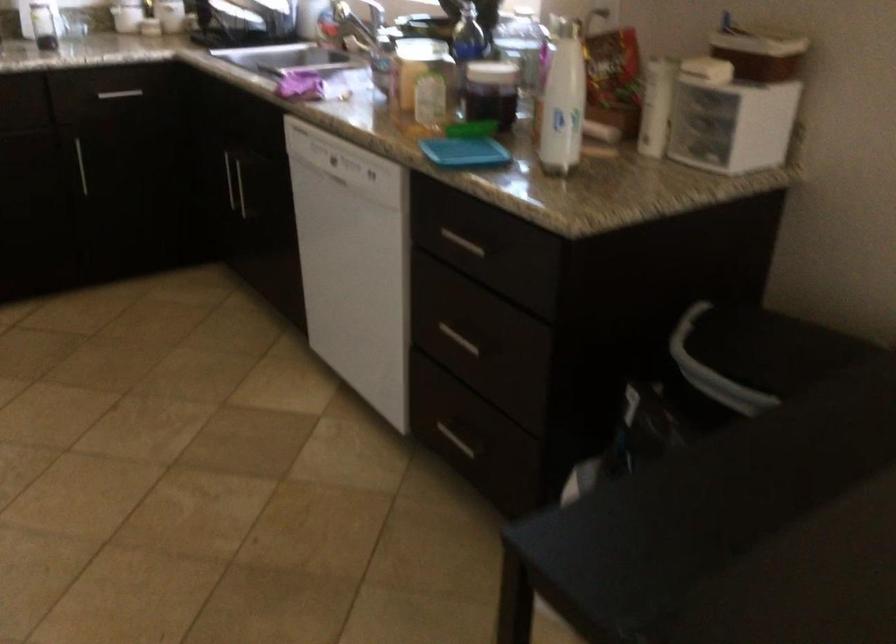
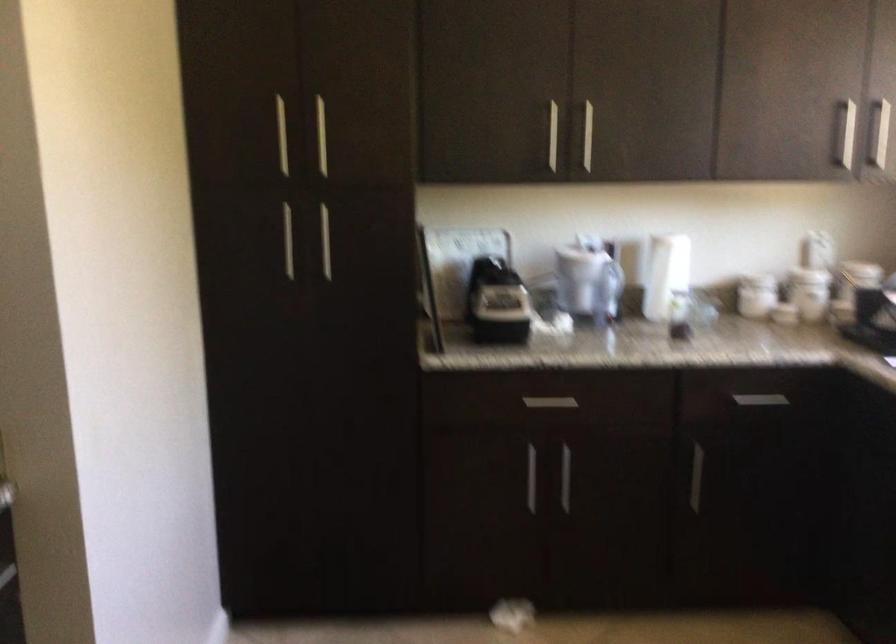
In the second image, find the point that corresponds to (x=121, y=95) in the first image.

(760, 400)